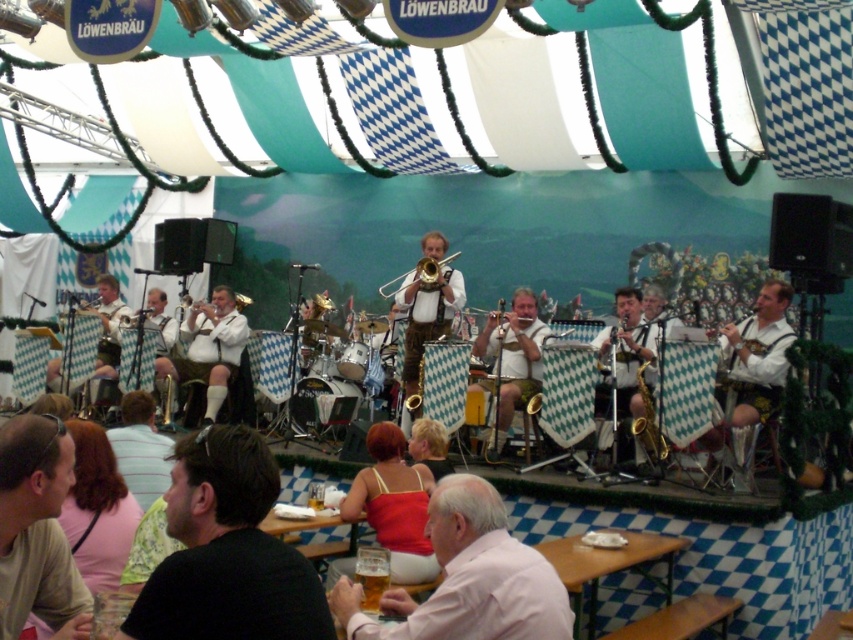
Does white leather shirt at right have a greater height compared to white matte flute at center?

Incorrect, white leather shirt at right's height is not larger of white matte flute at center's.

The width and height of the screenshot is (853, 640). What do you see at coordinates (752, 364) in the screenshot?
I see `white leather shirt at right` at bounding box center [752, 364].

Image resolution: width=853 pixels, height=640 pixels. In order to click on white leather shirt at right in this screenshot , I will do `click(752, 364)`.

Where is `white leather shirt at right`? Image resolution: width=853 pixels, height=640 pixels. white leather shirt at right is located at coordinates (752, 364).

Between satin gold saxophone at center and light blue shirt at lower left, which one has more height?

satin gold saxophone at center is taller.

Between point (627, 403) and point (126, 394), which one is positioned behind?

Positioned behind is point (627, 403).

Identify the location of satin gold saxophone at center. (621, 355).

Does black shirt at lower left have a larger size compared to leather jacket at center?

Incorrect, black shirt at lower left is not larger than leather jacket at center.

In order to click on black shirt at lower left in this screenshot , I will do `click(227, 552)`.